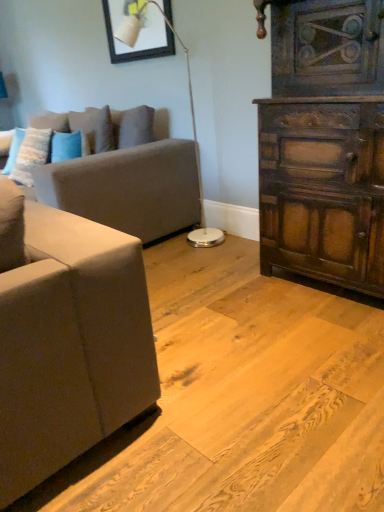
The height and width of the screenshot is (512, 384). Find the location of `empty space that is in between white glossy floor lamp at center and dark brown wood chest of drawers at right`. empty space that is in between white glossy floor lamp at center and dark brown wood chest of drawers at right is located at coordinates (232, 260).